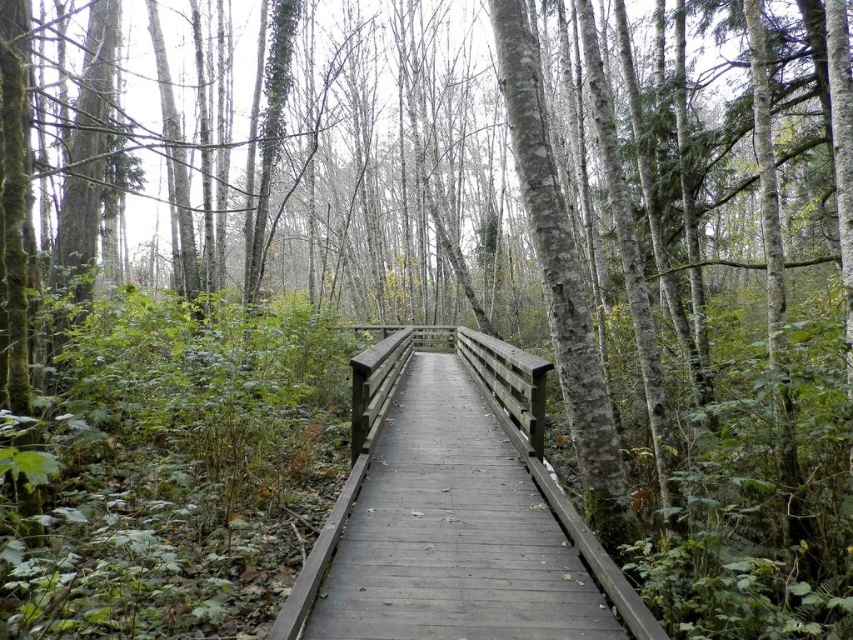
Question: Which point is farther to the camera?

Choices:
 (A) smooth wooden railing at center
 (B) smooth wooden bridge at center

Answer: (A)

Question: Is smooth wooden bridge at center bigger than smooth wooden railing at center?

Choices:
 (A) yes
 (B) no

Answer: (B)

Question: Which point is farther to the camera?

Choices:
 (A) (363, 452)
 (B) (508, 513)

Answer: (A)

Question: Which point is closer to the camera?

Choices:
 (A) smooth wooden bridge at center
 (B) smooth wooden railing at center

Answer: (A)

Question: Observing the image, what is the correct spatial positioning of smooth wooden bridge at center in reference to smooth wooden railing at center?

Choices:
 (A) above
 (B) below

Answer: (B)

Question: Can you confirm if smooth wooden bridge at center is smaller than smooth wooden railing at center?

Choices:
 (A) no
 (B) yes

Answer: (B)